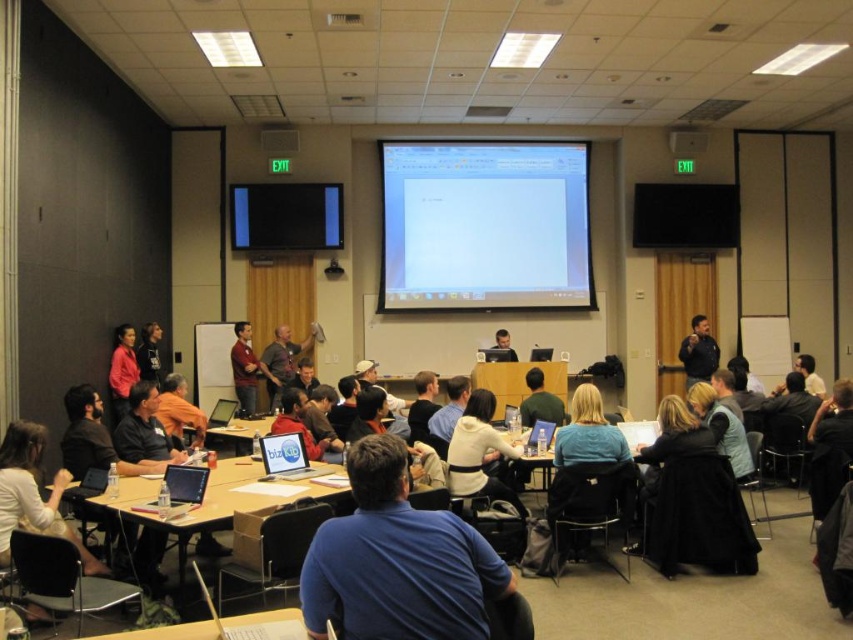
Question: Which of these objects is positioned farthest from the matte white board at upper center?

Choices:
 (A) blue cotton shirt at center
 (B) green matte shirt at center
 (C) matte plastic table at center
 (D) orange fabric shirt at center

Answer: (A)

Question: Does white glossy projector screen at upper center appear on the right side of matte black shirt at center?

Choices:
 (A) no
 (B) yes

Answer: (B)

Question: Is black glossy monitor at upper center to the left of green matte shirt at center from the viewer's perspective?

Choices:
 (A) yes
 (B) no

Answer: (A)

Question: Where is white glossy projector screen at upper center located in relation to matte white board at upper center in the image?

Choices:
 (A) right
 (B) left

Answer: (B)

Question: Estimate the real-world distances between objects in this image. Which object is closer to the white glossy projector screen at upper center?

Choices:
 (A) matte black jacket at center
 (B) black glossy monitor at upper center
 (C) wooden at center
 (D) blue cotton shirt at center

Answer: (B)

Question: Which point appears closest to the camera in this image?

Choices:
 (A) (451, 452)
 (B) (701, 150)
 (C) (532, 381)
 (D) (120, 333)

Answer: (A)